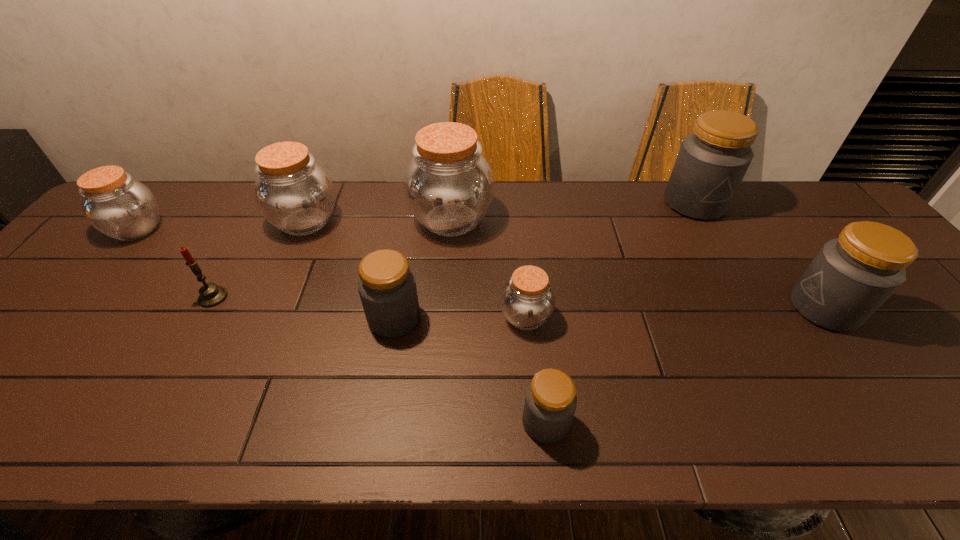
In order to click on the smallest brown jar in this screenshot , I will do `click(527, 300)`.

In order to click on the rightmost brown jar in this screenshot , I will do `click(527, 300)`.

This screenshot has width=960, height=540. What are the coordinates of `the nearest object` in the screenshot? It's located at (550, 402).

This screenshot has height=540, width=960. In order to click on the nearest gray jar in this screenshot , I will do `click(550, 402)`.

This screenshot has height=540, width=960. I want to click on free space located on the surface of the farthest gray jar near the warning symbol, so click(725, 258).

Identify the location of vacant space located on the right of the biggest brown jar. (511, 220).

At what (x,y) coordinates should I click in order to perform the action: click on vacant space situated 0.150m on the left of the second biggest brown jar. Please return your answer as a coordinate pair (x, y). Looking at the image, I should click on (219, 221).

The width and height of the screenshot is (960, 540). Identify the location of free spot located on the surface of the third smallest gray jar near the warning symbol. (759, 308).

This screenshot has height=540, width=960. Find the location of `free point located 0.250m on the surface of the third smallest gray jar near the warning symbol`. free point located 0.250m on the surface of the third smallest gray jar near the warning symbol is located at coordinates (689, 308).

The height and width of the screenshot is (540, 960). I want to click on vacant space located 0.330m on the surface of the third smallest gray jar near the warning symbol, so click(x=657, y=308).